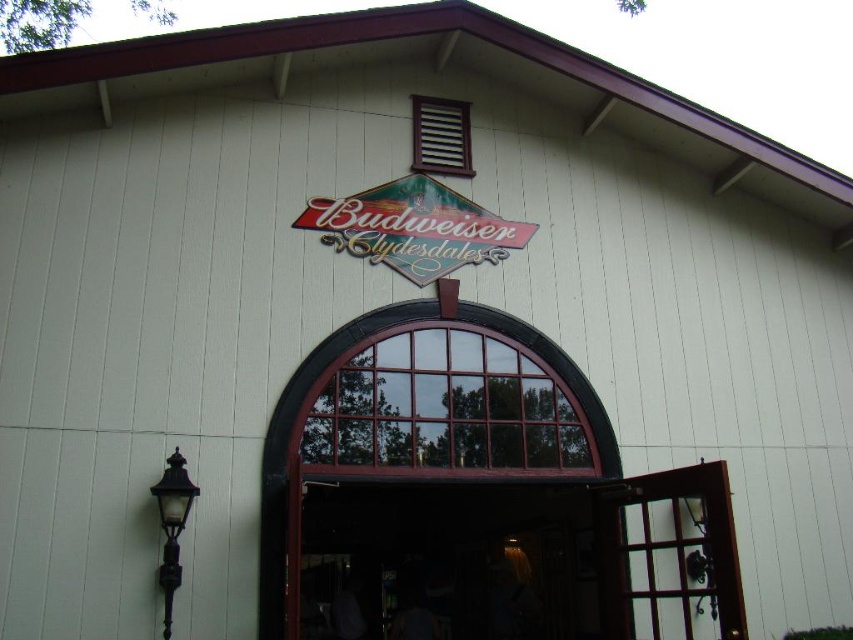
Question: Does wooden door at center have a larger size compared to shiny pink plastic sign at center?

Choices:
 (A) no
 (B) yes

Answer: (A)

Question: Which point appears closest to the camera in this image?

Choices:
 (A) (389, 264)
 (B) (705, 563)

Answer: (B)

Question: Where is wooden door at center located in relation to shiny pink plastic sign at center in the image?

Choices:
 (A) above
 (B) below

Answer: (B)

Question: From the image, what is the correct spatial relationship of wooden door at center in relation to shiny pink plastic sign at center?

Choices:
 (A) left
 (B) right

Answer: (B)